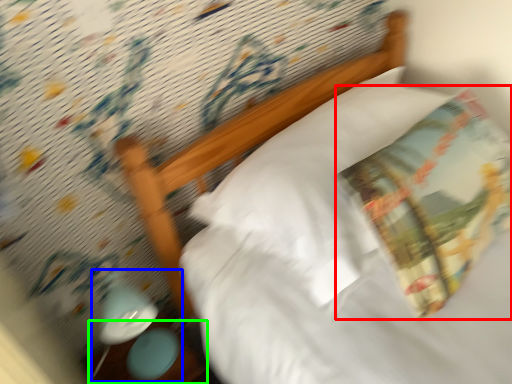
Question: Estimate the real-world distances between objects in this image. Which object is closer to throw pillow (highlighted by a red box), lamp (highlighted by a blue box) or table (highlighted by a green box)?

Choices:
 (A) lamp
 (B) table

Answer: (A)